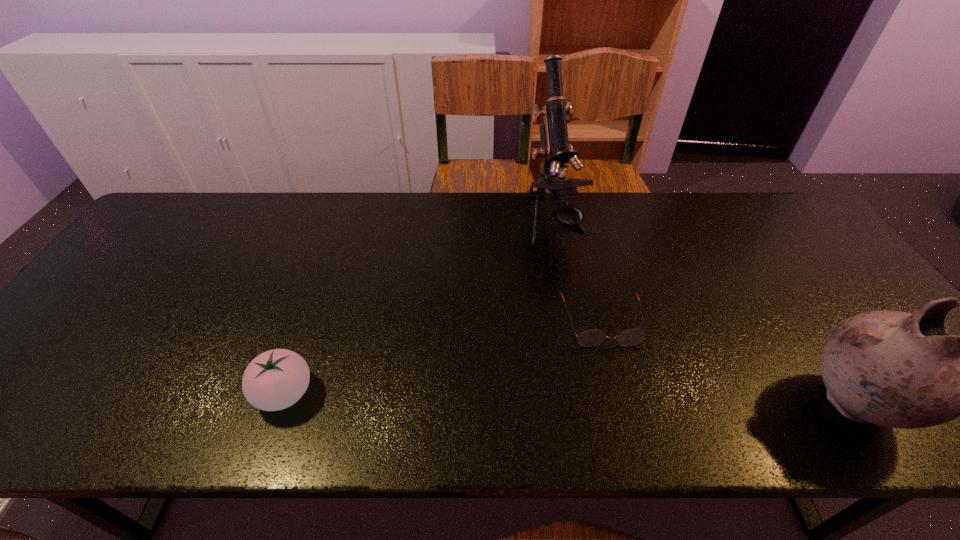
You are a GUI agent. You are given a task and a screenshot of the screen. Output one action in this format:
    pyautogui.click(x=<x>, y=<y>)
    Task: Click on the vacant area that lies between the rightmost object and the shortest object
    The image size is (960, 540).
    Given the screenshot: What is the action you would take?
    pyautogui.click(x=728, y=362)

Image resolution: width=960 pixels, height=540 pixels. In order to click on free space between the rightmost object and the farthest object in this screenshot , I will do `click(704, 313)`.

This screenshot has height=540, width=960. I want to click on object that is the third closest to the second tallest object, so click(x=276, y=379).

At what (x,y) coordinates should I click in order to perform the action: click on the closest object to the third shortest object. Please return your answer as a coordinate pair (x, y). The image size is (960, 540). Looking at the image, I should click on (592, 337).

This screenshot has width=960, height=540. I want to click on vacant position in the image that satisfies the following two spatial constraints: 1. on the back side of the third tallest object; 2. on the right side of the spectacles, so click(310, 322).

Identify the location of vacant space that satisfies the following two spatial constraints: 1. on the back side of the third tallest object; 2. on the left side of the tallest object. (345, 222).

You are a GUI agent. You are given a task and a screenshot of the screen. Output one action in this format:
    pyautogui.click(x=<x>, y=<y>)
    Task: Click on the free spot that satisfies the following two spatial constraints: 1. on the front side of the tallest object; 2. from the spout of the pottery
    
    Given the screenshot: What is the action you would take?
    pyautogui.click(x=588, y=403)

Where is `vacant space that satisfies the following two spatial constraints: 1. on the back side of the third nearest object; 2. on the left side of the second shortest object`? The width and height of the screenshot is (960, 540). vacant space that satisfies the following two spatial constraints: 1. on the back side of the third nearest object; 2. on the left side of the second shortest object is located at coordinates (310, 322).